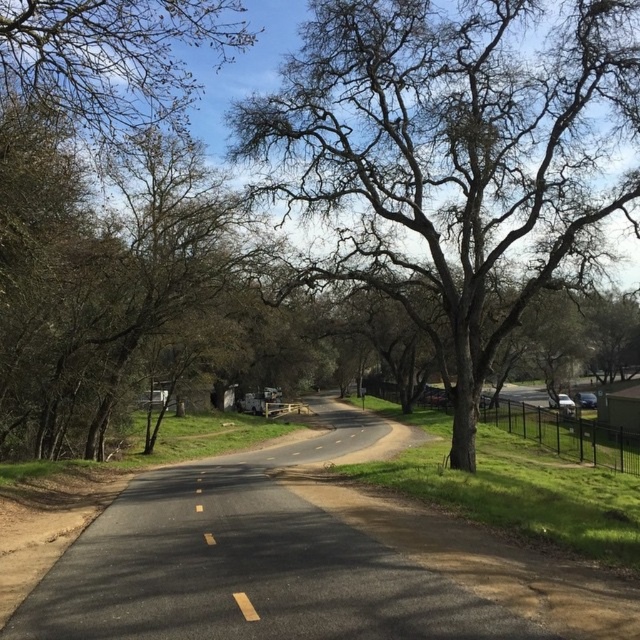
Is bare branches at center thinner than yellow asphalt line at center?

No.

Looking at this image, between bare branches at center and yellow asphalt line at center, which one is positioned higher?

bare branches at center

Which is in front, point (310, 266) or point (205, 532)?

Point (205, 532) is in front.

Identify the location of bare branches at center. The image size is (640, 640). (452, 154).

Between point (54, 99) and point (236, 596), which one is positioned in front?

Point (236, 596) is in front.

Who is positioned more to the left, bare branches at upper left or yellow asphalt line at center?

bare branches at upper left

Who is more forward, (67,10) or (244,596)?

Point (244,596) is more forward.

Locate an element on the screen. bare branches at upper left is located at coordinates (113, 54).

Is the position of bare branches at center more distant than that of bare branches at upper left?

Yes.

Between bare branches at center and bare branches at upper left, which one appears on the right side from the viewer's perspective?

bare branches at center is more to the right.

The image size is (640, 640). What do you see at coordinates (452, 154) in the screenshot? I see `bare branches at center` at bounding box center [452, 154].

What are the coordinates of `bare branches at center` in the screenshot? It's located at click(x=452, y=154).